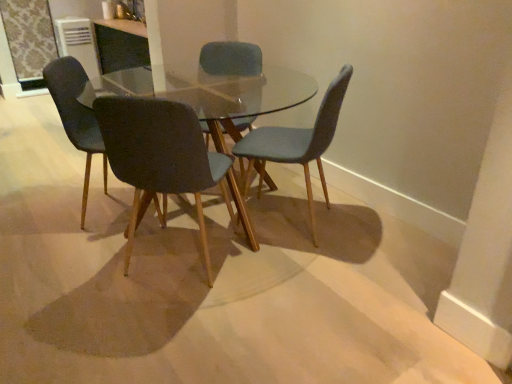
Question: From the image's perspective, is matte blue chair at center, marked as the first chair in a right-to-left arrangement, located beneath matte black chair at left, the 4th chair positioned from the right?

Choices:
 (A) no
 (B) yes

Answer: (B)

Question: Is matte blue chair at center, the fourth chair from the left, positioned beyond the bounds of matte black chair at left, the 4th chair positioned from the right?

Choices:
 (A) no
 (B) yes

Answer: (B)

Question: Considering the relative sizes of matte blue chair at center, marked as the first chair in a right-to-left arrangement, and matte black chair at left, the 4th chair positioned from the right, in the image provided, is matte blue chair at center, marked as the first chair in a right-to-left arrangement, shorter than matte black chair at left, the 4th chair positioned from the right,?

Choices:
 (A) yes
 (B) no

Answer: (A)

Question: Is matte blue chair at center, the fourth chair from the left, facing away from matte black chair at left, the 4th chair positioned from the right?

Choices:
 (A) no
 (B) yes

Answer: (A)

Question: Is matte blue chair at center, marked as the first chair in a right-to-left arrangement, positioned before matte black chair at left, the 4th chair positioned from the right?

Choices:
 (A) no
 (B) yes

Answer: (B)

Question: From a real-world perspective, is matte blue chair at center, the fourth chair from the left, below matte black chair at left, arranged as the first chair when viewed from the left?

Choices:
 (A) yes
 (B) no

Answer: (A)

Question: Does clear glass table at center have a greater width compared to matte black chair at center, marked as the 3th chair in a right-to-left arrangement?

Choices:
 (A) yes
 (B) no

Answer: (A)

Question: Is clear glass table at center to the right of matte black chair at center, marked as the 3th chair in a right-to-left arrangement, from the viewer's perspective?

Choices:
 (A) no
 (B) yes

Answer: (B)

Question: Considering the relative sizes of clear glass table at center and matte black chair at center, marked as the 3th chair in a right-to-left arrangement, in the image provided, is clear glass table at center thinner than matte black chair at center, marked as the 3th chair in a right-to-left arrangement,?

Choices:
 (A) no
 (B) yes

Answer: (A)

Question: Can you confirm if clear glass table at center is shorter than matte black chair at center, which is the 2th chair in left-to-right order?

Choices:
 (A) yes
 (B) no

Answer: (A)

Question: Could matte black chair at center, which is the 2th chair in left-to-right order, be considered to be inside clear glass table at center?

Choices:
 (A) yes
 (B) no

Answer: (A)

Question: Are clear glass table at center and matte black chair at center, which is the 2th chair in left-to-right order, far apart?

Choices:
 (A) no
 (B) yes

Answer: (A)

Question: Is matte blue chair at center, which is counted as the 3th chair, starting from the left, not within matte black chair at left, arranged as the first chair when viewed from the left?

Choices:
 (A) yes
 (B) no

Answer: (A)